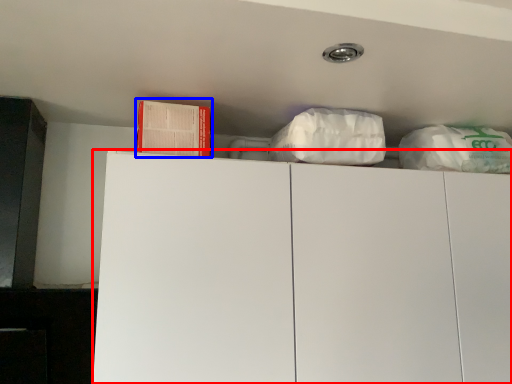
Question: Which object is closer to the camera taking this photo, cabinetry (highlighted by a red box) or book (highlighted by a blue box)?

Choices:
 (A) cabinetry
 (B) book

Answer: (A)